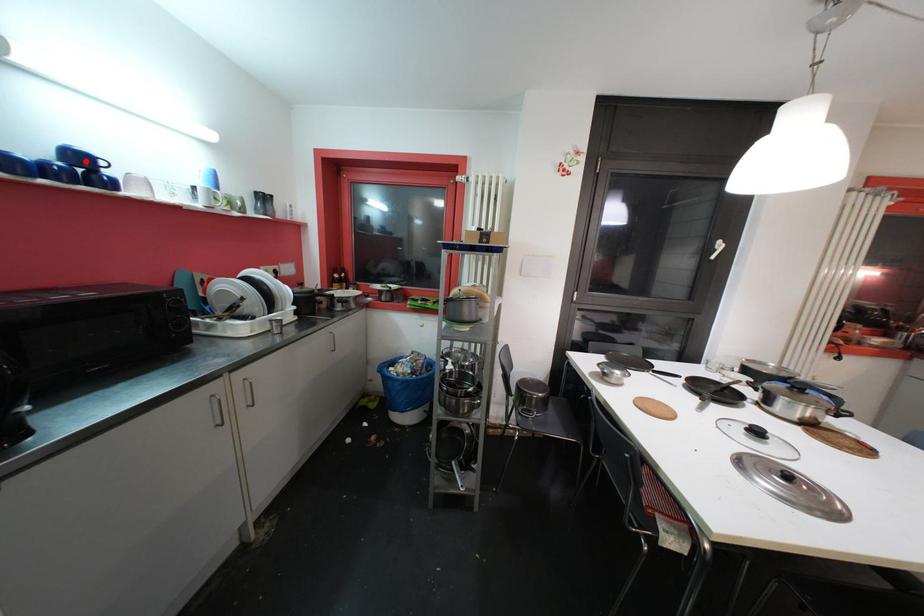
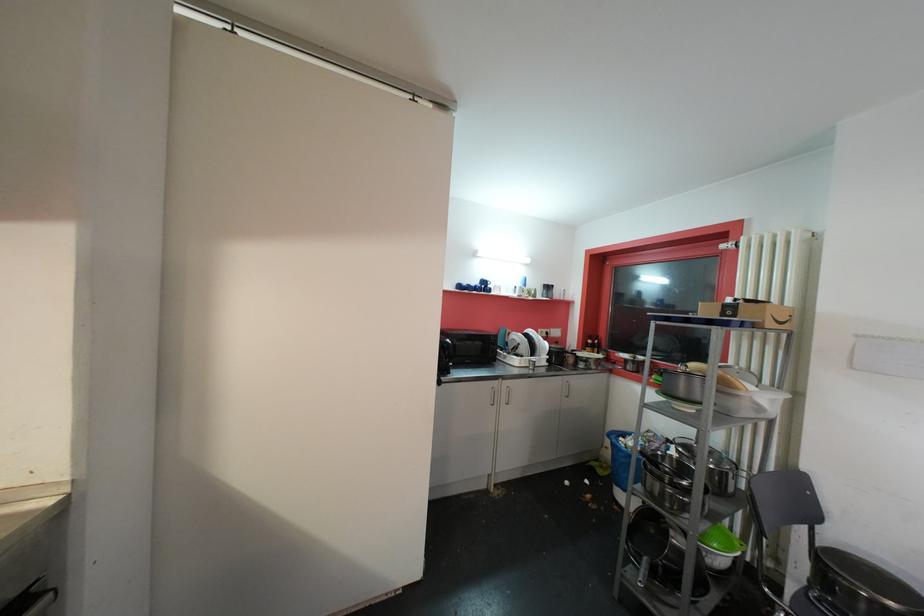
The point at the highlighted location is marked in the first image. Where is the corresponding point in the second image?

(489, 285)